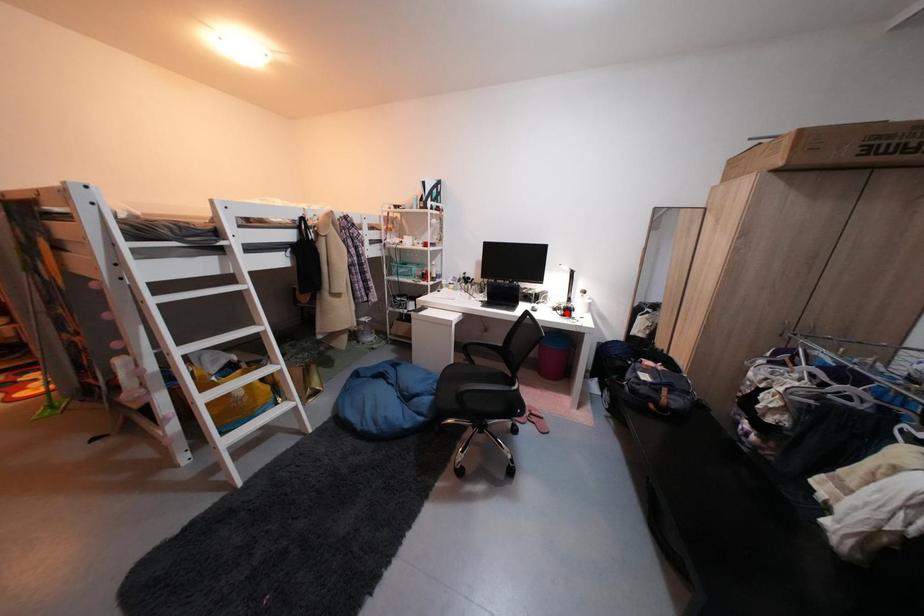
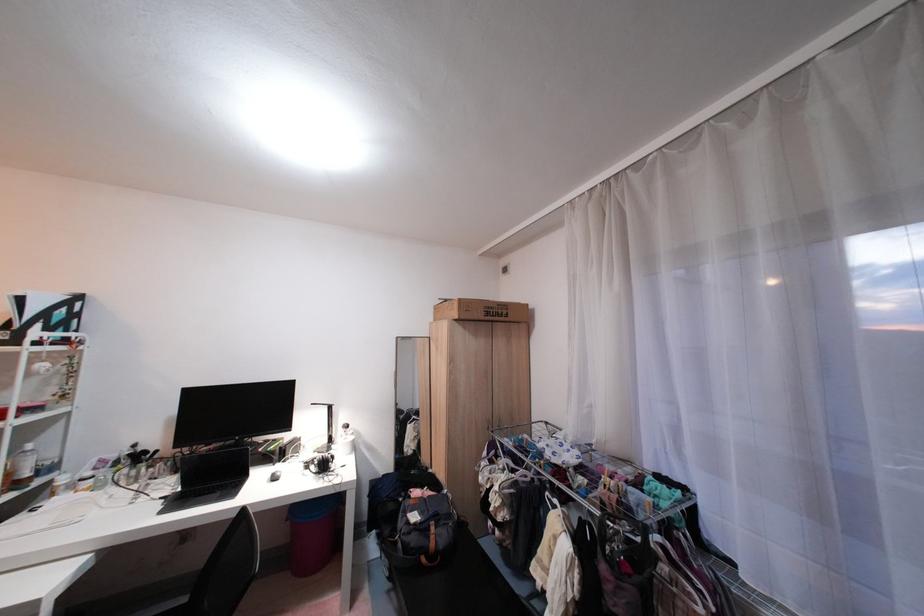
Question: I am providing you with two images of the same scene from different viewpoints. Given a red point in image1, look at the same physical point in image2. Is it:

Choices:
 (A) Closer to the viewpoint
 (B) Farther from the viewpoint

Answer: (B)